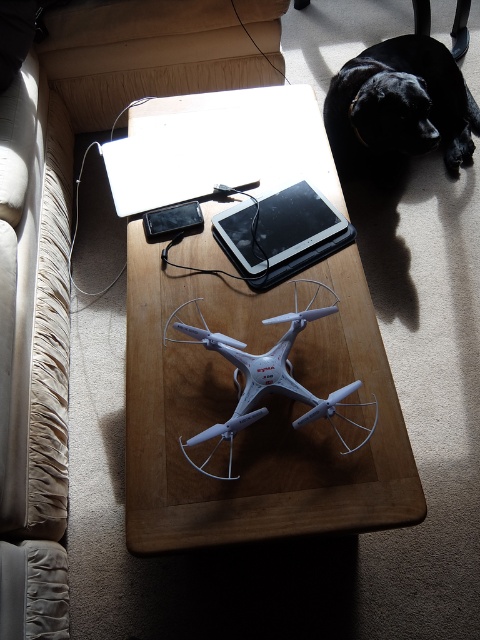
You are planning to place a new decorative item on the coffee table. The item is the same size as the black matte tablet at center. Based on the scene, will this new item fit on the beige fabric couch at left without overlapping its edges?

The beige fabric couch at left has a larger size compared to the black matte tablet at center. Since the new item is the same size as the tablet, it will fit on the couch without overlapping the edges.

You are a delivery person who needs to place a large package on the table between the beige fabric couch at left and the black matte tablet at center. Can you fit the package if it measures 60 centimeters in length?

The distance between the beige fabric couch at left and the black matte tablet at center is 61.36 centimeters. Since the package is 60 centimeters long, it should fit with about 1.36 centimeters of space remaining.

You are a delivery person who needs to place a package between the black matte tablet at center and the black matte tablet at upper center on the coffee table. Which tablet should you place the package closer to in order to have it nearer to the viewer?

You should place the package closer to the black matte tablet at center because it is already closer to the viewer than the black matte tablet at upper center.